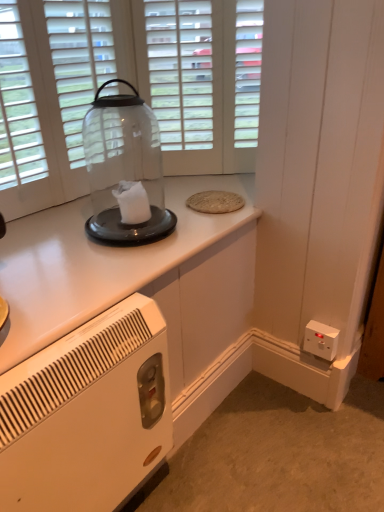
In order to click on free space behind transparent glass jar at center in this screenshot , I will do pos(143,193).